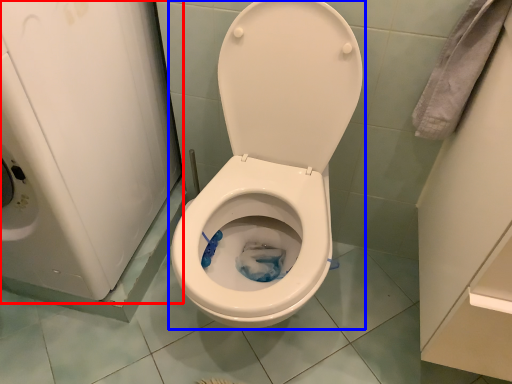
Question: Which object appears closest to the camera in this image, appliance (highlighted by a red box) or toilet (highlighted by a blue box)?

Choices:
 (A) appliance
 (B) toilet

Answer: (A)